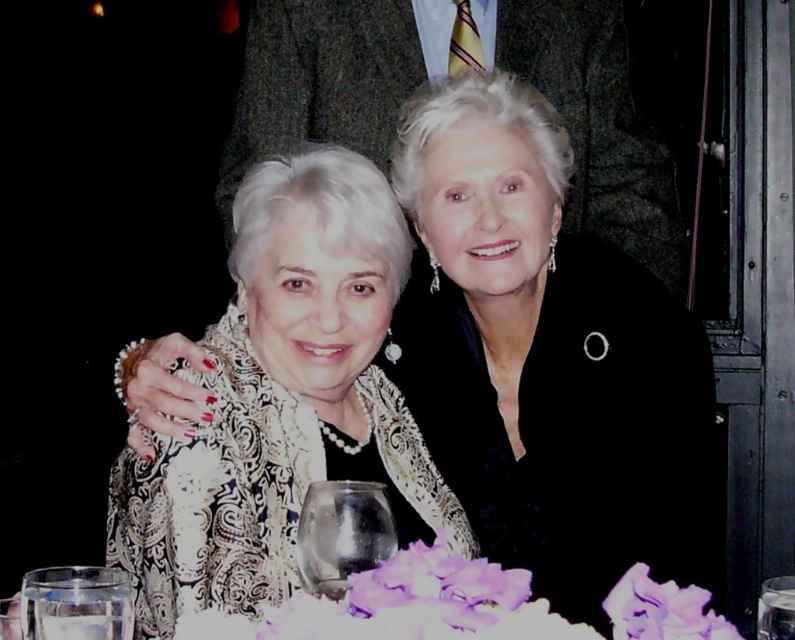
Is dark gray textured suit at upper center taller than transparent glass wine glass at lower center?

Yes.

Who is more forward, (661, 188) or (778, 632)?

Point (778, 632) is more forward.

This screenshot has height=640, width=795. Find the location of `dark gray textured suit at upper center`. dark gray textured suit at upper center is located at coordinates (598, 124).

Which is more to the right, white lace dress at center or transparent glass at center?

transparent glass at center is more to the right.

Who is higher up, white lace dress at center or transparent glass at center?

white lace dress at center is above.

At what (x,y) coordinates should I click in order to perform the action: click on white lace dress at center. Please return your answer as a coordinate pair (x, y). Looking at the image, I should click on (281, 400).

From the picture: Can you confirm if white lace dress at center is positioned below clear glass wine glass at lower left?

No, white lace dress at center is not below clear glass wine glass at lower left.

Between white lace dress at center and clear glass wine glass at lower left, which one appears on the left side from the viewer's perspective?

clear glass wine glass at lower left

What are the coordinates of `white lace dress at center` in the screenshot? It's located at (281, 400).